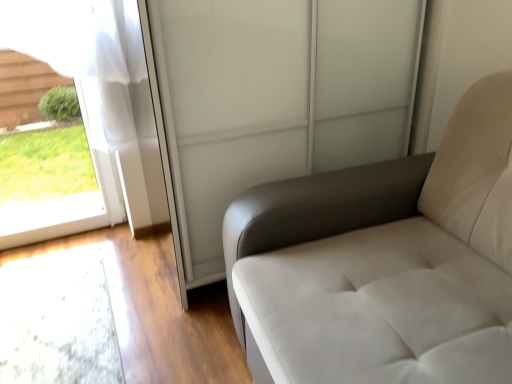
The height and width of the screenshot is (384, 512). What are the coordinates of `clear glass window at left` in the screenshot? It's located at (80, 109).

In order to face transparent glass screen door at upper center, should I rotate leftwards or rightwards?

Rotate your view right by about 1.780°.

This screenshot has height=384, width=512. Identify the location of white leather armchair at right. (384, 262).

Between clear glass window at left and white leather armchair at right, which one is positioned behind?

clear glass window at left is further away from the camera.

Which is in front, point (106, 86) or point (360, 318)?

The point (360, 318) is in front.

Based on the photo, from a real-world perspective, who is located lower, clear glass window at left or white leather armchair at right?

white leather armchair at right, from a real-world perspective.

Is transparent glass screen door at upper center facing away from white leather armchair at right?

No.

What's the angular difference between transparent glass screen door at upper center and white leather armchair at right's facing directions?

transparent glass screen door at upper center and white leather armchair at right are facing 93.2 degrees away from each other.

From the image's perspective, between transparent glass screen door at upper center and white leather armchair at right, who is located below?

white leather armchair at right appears lower in the image.

From a real-world perspective, is transparent glass screen door at upper center on white leather armchair at right?

Yes.

Does transparent glass screen door at upper center appear on the right side of clear glass window at left?

Yes.

In the scene shown: Which object is further away from the camera taking this photo, transparent glass screen door at upper center or clear glass window at left?

clear glass window at left is more distant.

Is transparent glass screen door at upper center far away from clear glass window at left?

No, transparent glass screen door at upper center is not far from clear glass window at left.

Based on the photo, from a real-world perspective, relative to clear glass window at left, is transparent glass screen door at upper center vertically above or below?

transparent glass screen door at upper center is situated higher than clear glass window at left in the real world.

What are the coordinates of `screen door on the right of the clear glass window at left` in the screenshot? It's located at pos(271,101).

In the scene shown: Is clear glass window at left directly adjacent to transparent glass screen door at upper center?

clear glass window at left and transparent glass screen door at upper center are not in contact.

Consider the image. Is clear glass window at left oriented towards transparent glass screen door at upper center?

No, clear glass window at left is not facing towards transparent glass screen door at upper center.

Can you confirm if clear glass window at left is bigger than transparent glass screen door at upper center?

Actually, clear glass window at left might be smaller than transparent glass screen door at upper center.

Would you say white leather armchair at right contains transparent glass screen door at upper center?

Actually, transparent glass screen door at upper center is outside white leather armchair at right.

Between point (406, 230) and point (157, 49), which one is positioned in front?

Positioned in front is point (157, 49).

Considering the relative positions of white leather armchair at right and transparent glass screen door at upper center in the image provided, is white leather armchair at right to the left or to the right of transparent glass screen door at upper center?

white leather armchair at right is to the right of transparent glass screen door at upper center.

Is white leather armchair at right positioned far away from transparent glass screen door at upper center?

That's not correct — white leather armchair at right is a little close to transparent glass screen door at upper center.

Is white leather armchair at right inside or outside of clear glass window at left?

white leather armchair at right is spatially situated outside clear glass window at left.

Is point (456, 212) positioned before point (126, 128)?

Yes, point (456, 212) is closer to viewer.

How many degrees apart are the facing directions of white leather armchair at right and clear glass window at left?

The angular difference between white leather armchair at right and clear glass window at left is 92.7 degrees.

Can you confirm if white leather armchair at right is taller than clear glass window at left?

In fact, white leather armchair at right may be shorter than clear glass window at left.

Where is `window behind the white leather armchair at right`? window behind the white leather armchair at right is located at coordinates (80, 109).

What are the coordinates of `furniture to the right of transparent glass screen door at upper center` in the screenshot? It's located at (384, 262).

Looking at the image, which one is located further to clear glass window at left, white leather armchair at right or transparent glass screen door at upper center?

Based on the image, white leather armchair at right appears to be further to clear glass window at left.

Estimate the real-world distances between objects in this image. Which object is closer to clear glass window at left, transparent glass screen door at upper center or white leather armchair at right?

Among the two, transparent glass screen door at upper center is located nearer to clear glass window at left.

Based on their spatial positions, is transparent glass screen door at upper center or clear glass window at left further from white leather armchair at right?

clear glass window at left is further to white leather armchair at right.

When comparing their distances from transparent glass screen door at upper center, does clear glass window at left or white leather armchair at right seem further?

The object further to transparent glass screen door at upper center is clear glass window at left.

Based on their spatial positions, is white leather armchair at right or clear glass window at left further from transparent glass screen door at upper center?

Based on the image, clear glass window at left appears to be further to transparent glass screen door at upper center.

Which object lies further to the anchor point white leather armchair at right, clear glass window at left or transparent glass screen door at upper center?

clear glass window at left is further to white leather armchair at right.

Identify the location of screen door situated between clear glass window at left and white leather armchair at right from left to right. (271, 101).